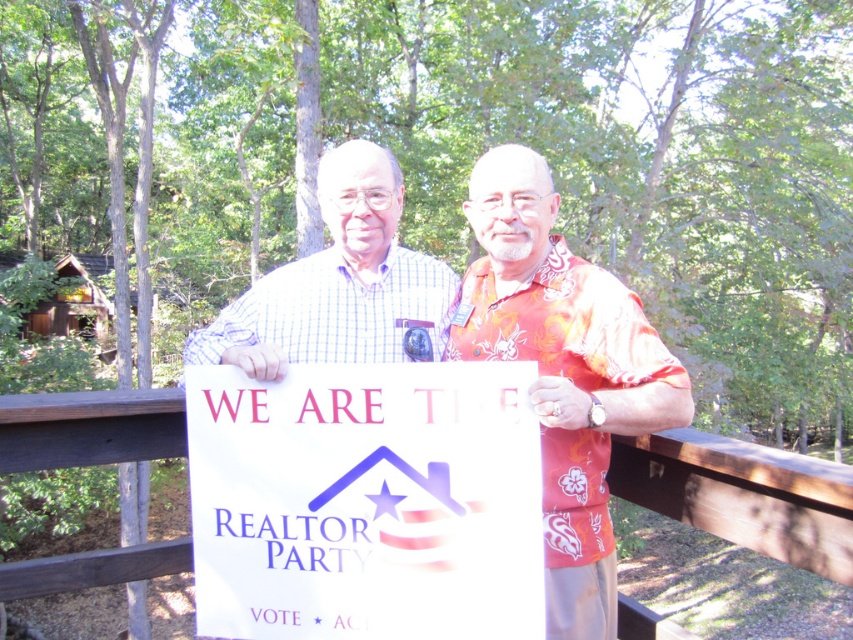
Who is lower down, white paper sign at center or checkered fabric shirt at center?

white paper sign at center is below.

Does point (258, 582) come farther from viewer compared to point (293, 326)?

No.

Identify the location of white paper sign at center. (366, 500).

Where is `white paper sign at center`? The width and height of the screenshot is (853, 640). white paper sign at center is located at coordinates (366, 500).

Measure the distance between point (x=131, y=426) and camera.

The distance of point (x=131, y=426) from camera is 6.64 feet.

Which of these two, wooden rail at center or checkered fabric shirt at center, stands shorter?

With less height is wooden rail at center.

The width and height of the screenshot is (853, 640). Describe the element at coordinates (744, 493) in the screenshot. I see `wooden rail at center` at that location.

Image resolution: width=853 pixels, height=640 pixels. Identify the location of wooden rail at center. coord(744,493).

In the scene shown: Who is more distant from viewer, [328,508] or [486,157]?

The point [486,157] is more distant.

Which is below, white paper sign at center or matte white sign at center?

white paper sign at center

Which is in front, point (274, 477) or point (585, 611)?

Positioned in front is point (274, 477).

The height and width of the screenshot is (640, 853). Find the location of `white paper sign at center`. white paper sign at center is located at coordinates click(x=366, y=500).